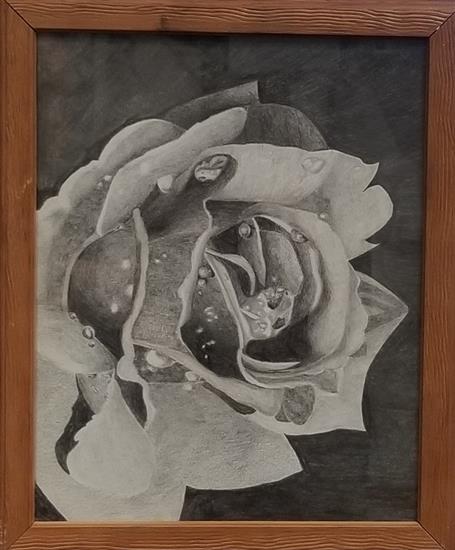
The width and height of the screenshot is (455, 550). What are the coordinates of `corners of picture frame` in the screenshot? It's located at (2, 0), (453, 0), (452, 546), (1, 547).